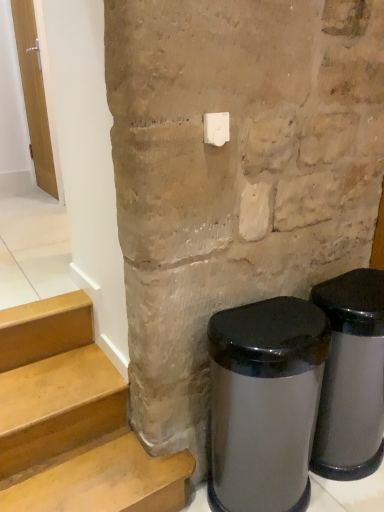
Question: From the image's perspective, would you say satin silver trash can at lower right, acting as the second waste container starting from the right, is shown under wooden door at left?

Choices:
 (A) yes
 (B) no

Answer: (A)

Question: Is satin silver trash can at lower right, which is counted as the 1th waste container, starting from the left, turned away from wooden door at left?

Choices:
 (A) yes
 (B) no

Answer: (A)

Question: Is satin silver trash can at lower right, acting as the second waste container starting from the right, further to camera compared to wooden door at left?

Choices:
 (A) no
 (B) yes

Answer: (A)

Question: Considering the relative sizes of satin silver trash can at lower right, acting as the second waste container starting from the right, and wooden door at left in the image provided, is satin silver trash can at lower right, acting as the second waste container starting from the right, thinner than wooden door at left?

Choices:
 (A) yes
 (B) no

Answer: (B)

Question: Does satin silver trash can at lower right, acting as the second waste container starting from the right, have a greater height compared to wooden door at left?

Choices:
 (A) yes
 (B) no

Answer: (B)

Question: From a real-world perspective, is satin silver trash can at lower right, which is counted as the 1th waste container, starting from the left, physically above wooden door at left?

Choices:
 (A) no
 (B) yes

Answer: (A)

Question: Does satin silver trash can at lower right, which is the 1th waste container in right-to-left order, come behind satin silver trash can at lower right, which is counted as the 1th waste container, starting from the left?

Choices:
 (A) no
 (B) yes

Answer: (B)

Question: Is satin silver trash can at lower right, the second waste container from the left, oriented away from satin silver trash can at lower right, which is counted as the 1th waste container, starting from the left?

Choices:
 (A) yes
 (B) no

Answer: (B)

Question: Does satin silver trash can at lower right, which is the 1th waste container in right-to-left order, come in front of satin silver trash can at lower right, acting as the second waste container starting from the right?

Choices:
 (A) no
 (B) yes

Answer: (A)

Question: Does satin silver trash can at lower right, the second waste container from the left, have a smaller size compared to satin silver trash can at lower right, which is counted as the 1th waste container, starting from the left?

Choices:
 (A) yes
 (B) no

Answer: (B)

Question: Can we say satin silver trash can at lower right, which is the 1th waste container in right-to-left order, lies outside satin silver trash can at lower right, which is counted as the 1th waste container, starting from the left?

Choices:
 (A) no
 (B) yes

Answer: (B)

Question: From the image's perspective, would you say satin silver trash can at lower right, the second waste container from the left, is shown under satin silver trash can at lower right, acting as the second waste container starting from the right?

Choices:
 (A) no
 (B) yes

Answer: (A)

Question: Is white plastic light switch at upper center further to the viewer compared to satin silver trash can at lower right, which is counted as the 1th waste container, starting from the left?

Choices:
 (A) no
 (B) yes

Answer: (B)